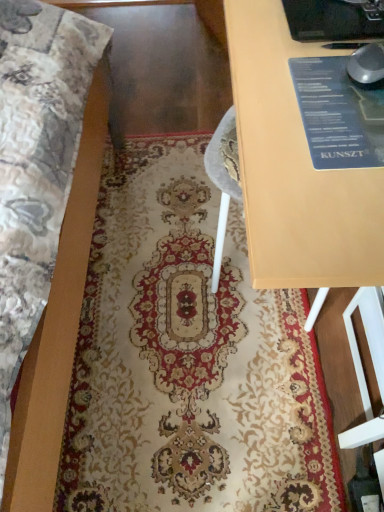
Identify the location of vacant area on top of carpet with intricate patterns at center (from a real-world perspective). (200, 296).